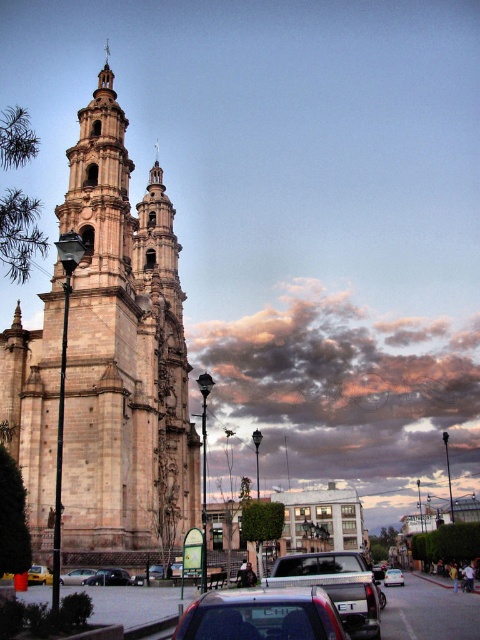
You are standing at the center of the image. Which direction should you look to see the beige stone tower at left?

The beige stone tower at left is located at the left side of the image, so you should look to your left to see it.